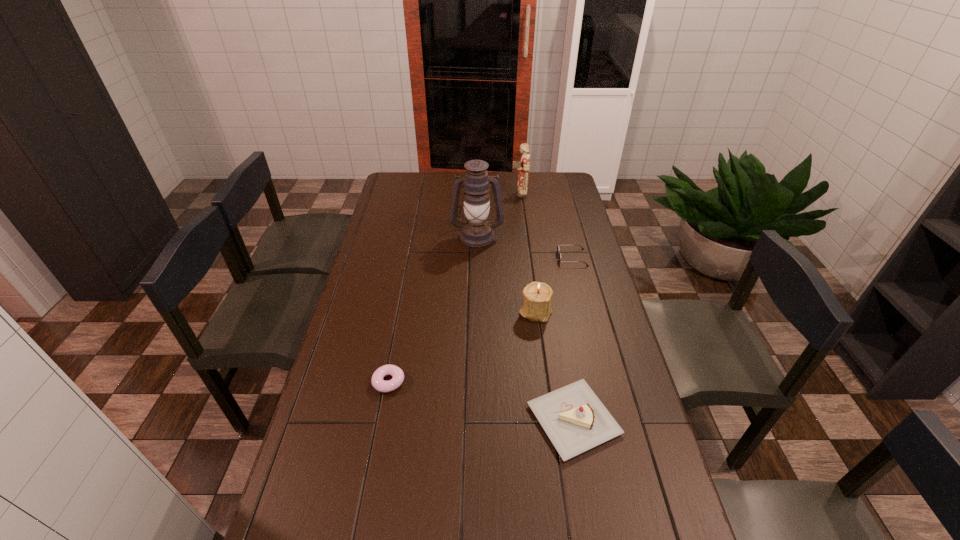
This screenshot has height=540, width=960. What are the coordinates of `the fifth object from right to left` in the screenshot? It's located at (476, 231).

Image resolution: width=960 pixels, height=540 pixels. Find the location of `oil lamp`. oil lamp is located at coordinates (476, 231).

Where is `the second tallest object`? the second tallest object is located at coordinates (524, 166).

Locate an element on the screen. The width and height of the screenshot is (960, 540). figurine is located at coordinates (524, 166).

The width and height of the screenshot is (960, 540). I want to click on the fourth shortest object, so click(x=537, y=299).

In order to click on the third nearest object in this screenshot , I will do `click(537, 299)`.

The width and height of the screenshot is (960, 540). I want to click on cake, so pos(575,420).

You are a GUI agent. You are given a task and a screenshot of the screen. Output one action in this format:
    pyautogui.click(x=<x>, y=<y>)
    Task: Click on the fourth nearest object
    This screenshot has width=960, height=540.
    Given the screenshot: What is the action you would take?
    pyautogui.click(x=558, y=249)

Locate an element on the screen. The width and height of the screenshot is (960, 540). doughnut is located at coordinates (378, 383).

This screenshot has width=960, height=540. I want to click on vacant space located 0.280m on the front of the second farthest object, so click(x=476, y=293).